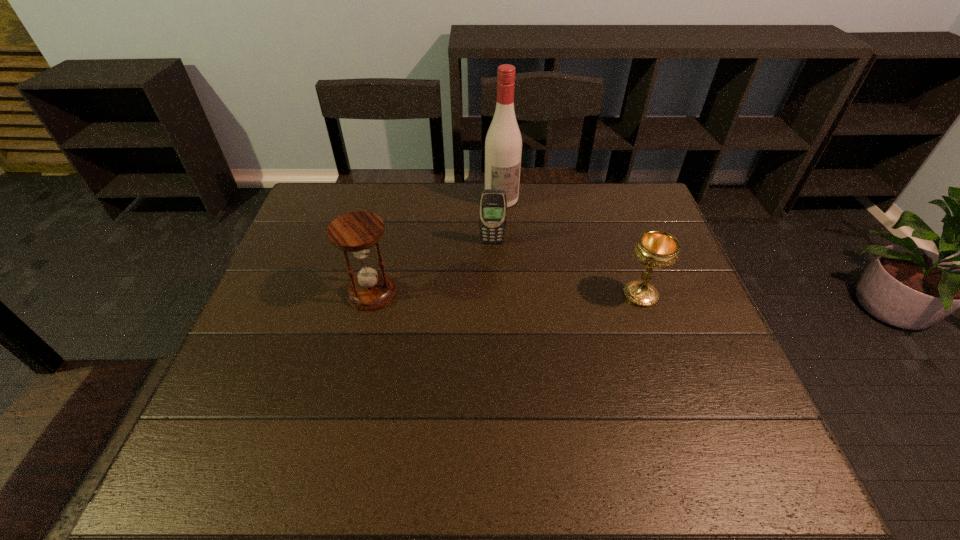
At what (x,y) coordinates should I click in order to perform the action: click on free space on the desktop that is between the second tallest object and the rightmost object and is positioned on the label of the tallest object. Please return your answer as a coordinate pair (x, y). This screenshot has height=540, width=960. Looking at the image, I should click on (541, 294).

I want to click on free spot on the desktop that is between the hourglass and the rightmost object and is positioned on the screen of the second farthest object, so click(x=492, y=294).